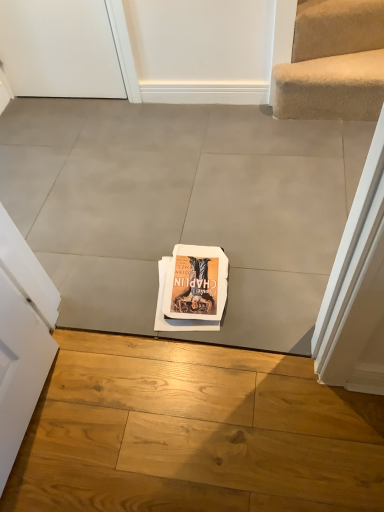
Question: In which direction should I rotate to look at gray tile floor at center, the 2th concrete from the back?

Choices:
 (A) left
 (B) right

Answer: (A)

Question: Would you say gray concrete at center, which ranks as the 1th concrete in back-to-front order, is part of gray tile floor at center, marked as the 1th concrete in a bottom-to-top arrangement,'s contents?

Choices:
 (A) no
 (B) yes

Answer: (A)

Question: Is gray tile floor at center, the second concrete in the top-to-bottom sequence, taller than gray concrete at center, arranged as the first concrete when viewed from the top?

Choices:
 (A) no
 (B) yes

Answer: (B)

Question: From a real-world perspective, does gray tile floor at center, marked as the 1th concrete in a bottom-to-top arrangement, sit lower than gray concrete at center, arranged as the first concrete when viewed from the top?

Choices:
 (A) no
 (B) yes

Answer: (B)

Question: From a real-world perspective, is gray tile floor at center, the second concrete in the top-to-bottom sequence, over gray concrete at center, arranged as the first concrete when viewed from the top?

Choices:
 (A) yes
 (B) no

Answer: (B)

Question: Considering the relative positions of gray tile floor at center, the 2th concrete from the back, and gray concrete at center, the second concrete when ordered from bottom to top, in the image provided, is gray tile floor at center, the 2th concrete from the back, behind gray concrete at center, the second concrete when ordered from bottom to top,?

Choices:
 (A) yes
 (B) no

Answer: (B)

Question: Does gray tile floor at center, the second concrete in the top-to-bottom sequence, turn towards gray concrete at center, the second concrete when ordered from bottom to top?

Choices:
 (A) no
 (B) yes

Answer: (B)

Question: From the image's perspective, is white matte door at upper left above matte paper book at center?

Choices:
 (A) no
 (B) yes

Answer: (B)

Question: Is white matte door at upper left taller than matte paper book at center?

Choices:
 (A) no
 (B) yes

Answer: (B)

Question: From a real-world perspective, is white matte door at upper left located higher than matte paper book at center?

Choices:
 (A) yes
 (B) no

Answer: (A)

Question: Could you tell me if white matte door at upper left is turned towards matte paper book at center?

Choices:
 (A) no
 (B) yes

Answer: (A)

Question: Can you confirm if white matte door at upper left is bigger than matte paper book at center?

Choices:
 (A) no
 (B) yes

Answer: (B)

Question: Considering the relative sizes of white matte door at upper left and matte paper book at center in the image provided, is white matte door at upper left thinner than matte paper book at center?

Choices:
 (A) no
 (B) yes

Answer: (B)

Question: Is gray concrete at center, arranged as the first concrete when viewed from the top, positioned before matte paper book at center?

Choices:
 (A) yes
 (B) no

Answer: (A)